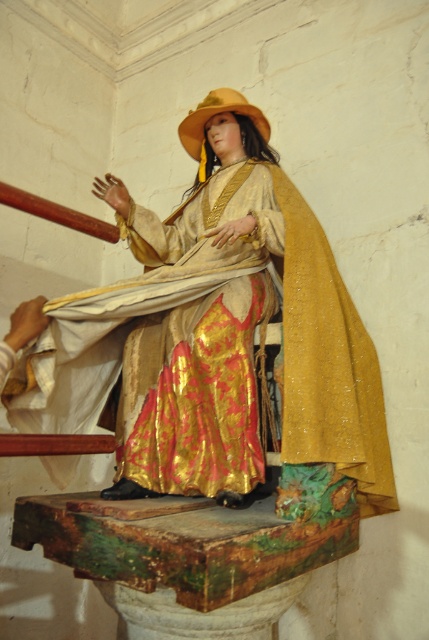
Looking at this image, you are standing in front of the statue and notice two points marked on the wall. The first point is at coordinate point (262, 280) and the second is at point (199, 128). Which point is closer to you?

Point (262, 280) is in front of point (199, 128), so it is closer to you.

In the scene shown: You are an interior designer assessing the statue in the image. You need to determine if the gold shiny dress at center and the golden textured hat at upper center can fit side by side on a display shelf that is 1.2 meters wide. Can they fit together without overlapping?

The gold shiny dress at center is wider than the golden textured hat at upper center. However, since the exact widths are not provided, it is impossible to determine if their combined width exceeds 1.2 meters. Additional measurements are required.